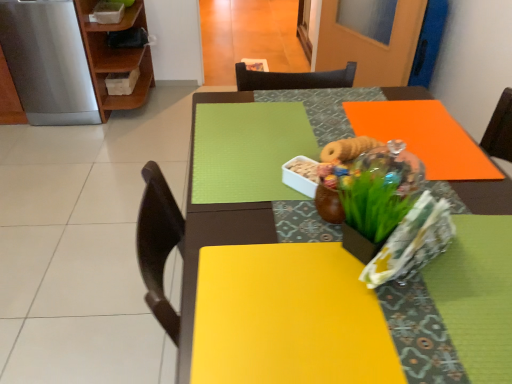
Find the location of `wooden shelf at upper left`. wooden shelf at upper left is located at coordinates (115, 57).

What do you see at coordinates (375, 188) in the screenshot?
I see `green matte floral arrangement at center` at bounding box center [375, 188].

The image size is (512, 384). Describe the element at coordinates (48, 62) in the screenshot. I see `stainless steel refrigerator at left` at that location.

This screenshot has height=384, width=512. Identify the location of wooden shelf at upper left. 115,57.

Which is farther from the camera, (189, 257) or (106, 52)?

The point (106, 52) is farther from the camera.

Considering the sizes of orange matte table at upper right and wooden shelf at upper left in the image, is orange matte table at upper right taller or shorter than wooden shelf at upper left?

Clearly, orange matte table at upper right is taller compared to wooden shelf at upper left.

Considering the relative sizes of orange matte table at upper right and wooden shelf at upper left in the image provided, is orange matte table at upper right bigger than wooden shelf at upper left?

Correct, orange matte table at upper right is larger in size than wooden shelf at upper left.

Is point (62, 12) positioned in front of point (121, 68)?

Yes, point (62, 12) is closer to viewer.

From a real-world perspective, who is located higher, stainless steel refrigerator at left or wooden shelf at upper left?

stainless steel refrigerator at left, from a real-world perspective.

Consider the image. Are stainless steel refrigerator at left and wooden shelf at upper left located far from each other?

stainless steel refrigerator at left is actually quite close to wooden shelf at upper left.

Between wooden shelf at upper left and green matte floral arrangement at center, which one appears on the right side from the viewer's perspective?

green matte floral arrangement at center.

Is there a large distance between wooden shelf at upper left and green matte floral arrangement at center?

wooden shelf at upper left is positioned a significant distance from green matte floral arrangement at center.

From the image's perspective, relative to green matte floral arrangement at center, is wooden shelf at upper left above or below?

wooden shelf at upper left is situated higher than green matte floral arrangement at center in the image.

Where is `floral arrangement on the right side of wooden shelf at upper left`? floral arrangement on the right side of wooden shelf at upper left is located at coordinates (375, 188).

From the image's perspective, is green matte floral arrangement at center under wooden shelf at upper left?

Yes, from the image's perspective, green matte floral arrangement at center is beneath wooden shelf at upper left.

Which object is wider, green matte floral arrangement at center or wooden shelf at upper left?

wooden shelf at upper left is wider.

From a real-world perspective, which is physically below, green matte floral arrangement at center or wooden shelf at upper left?

From a 3D spatial view, wooden shelf at upper left is below.

Based on the photo, is green matte floral arrangement at center at the left side of wooden shelf at upper left?

No.

From a real-world perspective, between orange matte table at upper right and stainless steel refrigerator at left, who is vertically lower?

stainless steel refrigerator at left is physically lower.

Considering the positions of objects orange matte table at upper right and stainless steel refrigerator at left in the image provided, who is more to the right, orange matte table at upper right or stainless steel refrigerator at left?

orange matte table at upper right is more to the right.

Who is smaller, orange matte table at upper right or stainless steel refrigerator at left?

Smaller between the two is stainless steel refrigerator at left.

Is orange matte table at upper right beside stainless steel refrigerator at left?

No, orange matte table at upper right is not touching stainless steel refrigerator at left.

From the picture: Considering the positions of objects green matte floral arrangement at center and stainless steel refrigerator at left in the image provided, who is in front, green matte floral arrangement at center or stainless steel refrigerator at left?

green matte floral arrangement at center is in front.

Is green matte floral arrangement at center at the right side of stainless steel refrigerator at left?

Yes.

From the image's perspective, is green matte floral arrangement at center below stainless steel refrigerator at left?

Yes, from the image's perspective, green matte floral arrangement at center is below stainless steel refrigerator at left.

What's the angular difference between green matte floral arrangement at center and stainless steel refrigerator at left's facing directions?

They differ by 61.2 degrees in their facing directions.

Is point (100, 46) positioned behind point (5, 13)?

Yes.

Can you confirm if wooden shelf at upper left is shorter than stainless steel refrigerator at left?

Yes.

Between wooden shelf at upper left and stainless steel refrigerator at left, which one has smaller width?

wooden shelf at upper left.

Is the position of wooden shelf at upper left more distant than that of stainless steel refrigerator at left?

Yes, wooden shelf at upper left is further from the viewer.

The height and width of the screenshot is (384, 512). What are the coordinates of `shelf that appears below the orange matte table at upper right (from a real-world perspective)` in the screenshot? It's located at (115, 57).

The image size is (512, 384). Find the location of `shelf above the stainless steel refrigerator at left (from the image's perspective)`. shelf above the stainless steel refrigerator at left (from the image's perspective) is located at coordinates (115, 57).

When comparing their distances from orange matte table at upper right, does wooden shelf at upper left or green matte floral arrangement at center seem further?

Among the two, wooden shelf at upper left is located further to orange matte table at upper right.

Looking at the image, which one is located further to stainless steel refrigerator at left, orange matte table at upper right or green matte floral arrangement at center?

green matte floral arrangement at center is positioned further to the anchor stainless steel refrigerator at left.

Looking at the image, which one is located further to wooden shelf at upper left, orange matte table at upper right or green matte floral arrangement at center?

Based on the image, green matte floral arrangement at center appears to be further to wooden shelf at upper left.

When comparing their distances from wooden shelf at upper left, does stainless steel refrigerator at left or orange matte table at upper right seem further?

Among the two, orange matte table at upper right is located further to wooden shelf at upper left.

Estimate the real-world distances between objects in this image. Which object is further from green matte floral arrangement at center, wooden shelf at upper left or orange matte table at upper right?

wooden shelf at upper left lies further to green matte floral arrangement at center than the other object.

Looking at the image, which one is located further to stainless steel refrigerator at left, orange matte table at upper right or wooden shelf at upper left?

orange matte table at upper right lies further to stainless steel refrigerator at left than the other object.

Estimate the real-world distances between objects in this image. Which object is closer to stainless steel refrigerator at left, wooden shelf at upper left or green matte floral arrangement at center?

Among the two, wooden shelf at upper left is located nearer to stainless steel refrigerator at left.

In the scene shown: Considering their positions, is green matte floral arrangement at center positioned further to wooden shelf at upper left than orange matte table at upper right?

Among the two, green matte floral arrangement at center is located further to wooden shelf at upper left.

At what (x,y) coordinates should I click in order to perform the action: click on floral arrangement located between orange matte table at upper right and wooden shelf at upper left in the depth direction. Please return your answer as a coordinate pair (x, y). The width and height of the screenshot is (512, 384). Looking at the image, I should click on (375, 188).

Where is `appliance positioned between orange matte table at upper right and wooden shelf at upper left from near to far`? appliance positioned between orange matte table at upper right and wooden shelf at upper left from near to far is located at coordinates (48, 62).

Locate an element on the screen. This screenshot has height=384, width=512. floral arrangement between orange matte table at upper right and stainless steel refrigerator at left in the front-back direction is located at coordinates (375, 188).

This screenshot has height=384, width=512. What are the coordinates of `appliance between green matte floral arrangement at center and wooden shelf at upper left in the front-back direction` in the screenshot? It's located at click(48, 62).